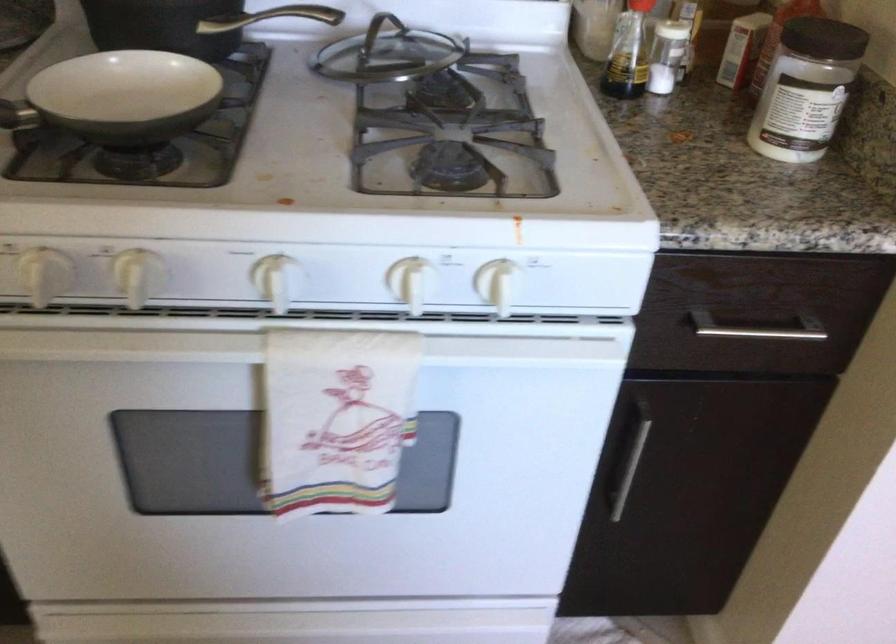
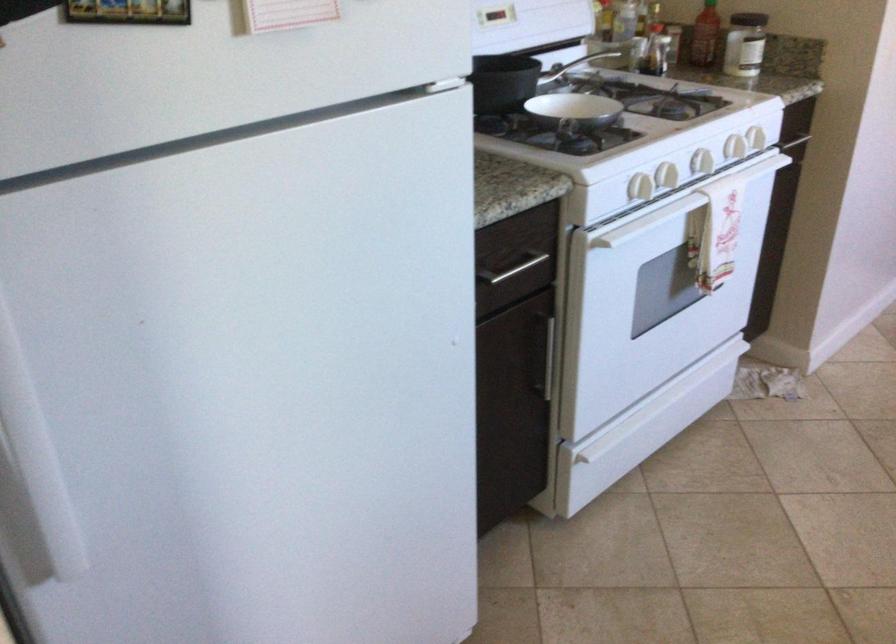
Find the pixel in the second image that matches pixel 289 352 in the first image.

(734, 147)